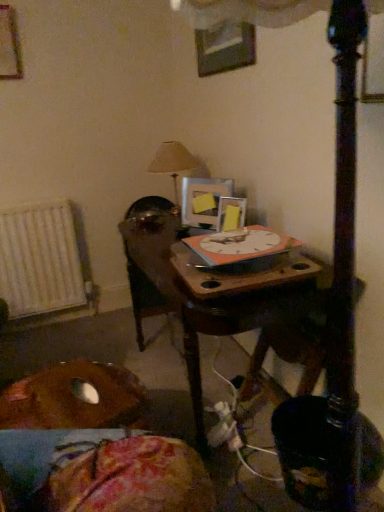
Locate an element on the screen. This screenshot has height=512, width=384. blank space above brown fabric cushion at lower left (from a real-world perspective) is located at coordinates (79, 390).